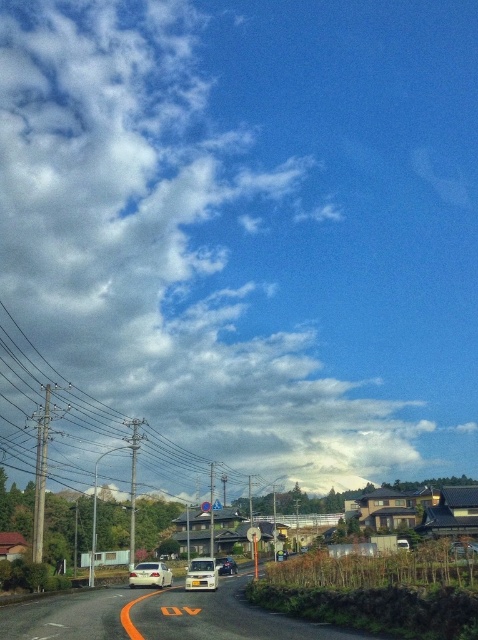
You are standing at the starting point of the road and see the white matte van at center. Which direction should you walk to reach the van?

Since the white matte van at center is located at point (202, 573), you should walk towards the center of the road to reach it.

You are a pedestrian standing on the road and see the white matte van at center and the metallic silver car at center. Which vehicle is closer to the sky?

The white matte van at center is closer to the sky because it is positioned above the metallic silver car at center.

You are a delivery driver who needs to park your vehicle on the road. You have a white matte van at center and a metallic silver car at center available. Which vehicle would require more space to park?

The white matte van at center is bigger than the metallic silver car at center, so it would require more space to park.